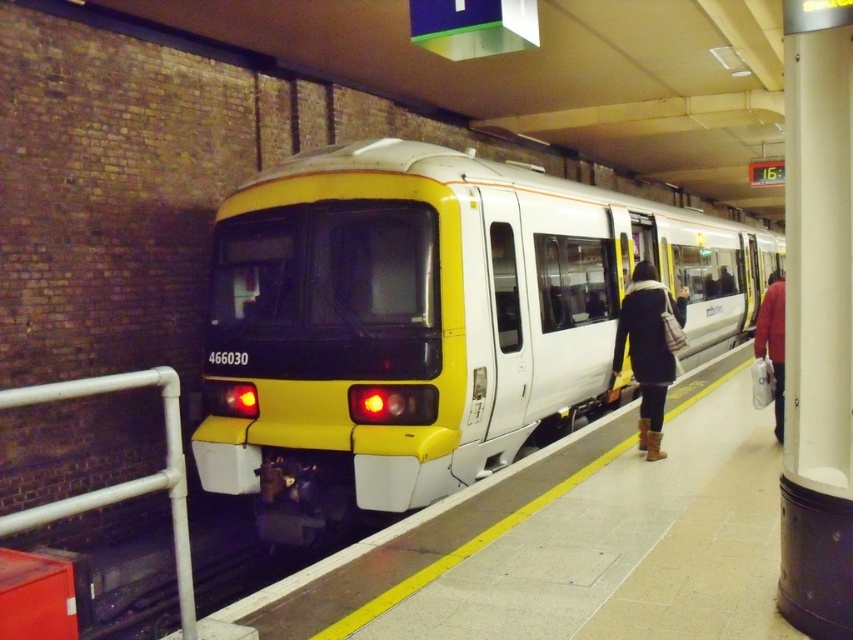
Looking at this image, based on the scene description, where is the yellow matte train at center located in terms of coordinates?

The yellow matte train at center is located at coordinates point (428, 321).